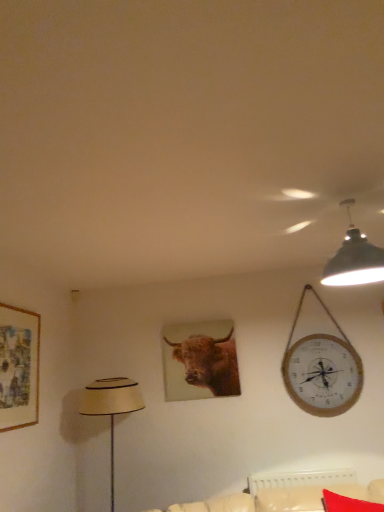
Question: Considering their positions, is wooden picture frame at left located in front of or behind red fabric pillow at lower right?

Choices:
 (A) behind
 (B) front

Answer: (B)

Question: Is point (34, 351) positioned closer to the camera than point (322, 503)?

Choices:
 (A) farther
 (B) closer

Answer: (A)

Question: Which object is positioned closest to the red fabric pillow at lower right?

Choices:
 (A) matte beige lampshade at left
 (B) wooden picture frame at left
 (C) brown matte/canvas at center
 (D) black matte lampshade at upper right

Answer: (C)

Question: Which is nearer to the red fabric pillow at lower right?

Choices:
 (A) brown matte/canvas at center
 (B) wooden picture frame at left
 (C) matte beige lampshade at left
 (D) black matte lampshade at upper right

Answer: (A)